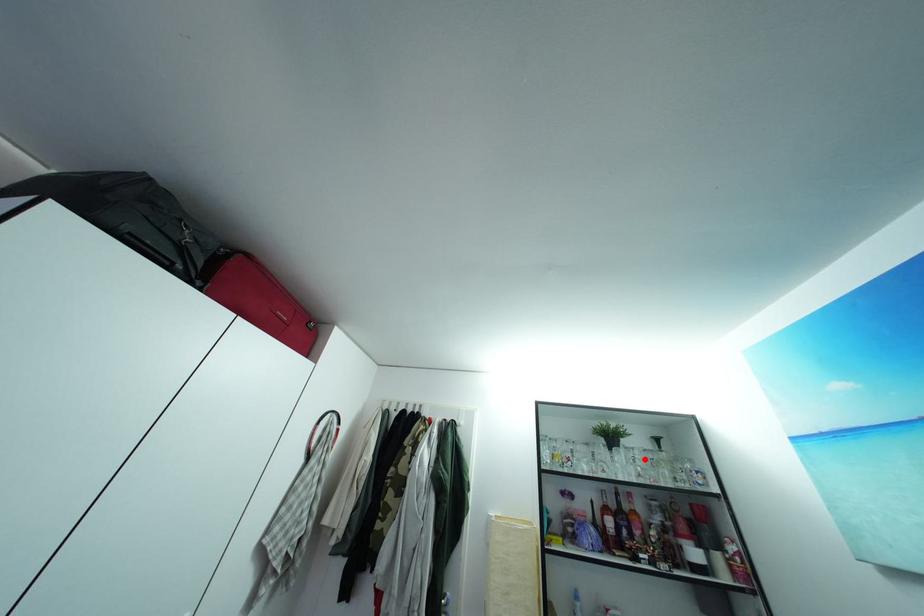
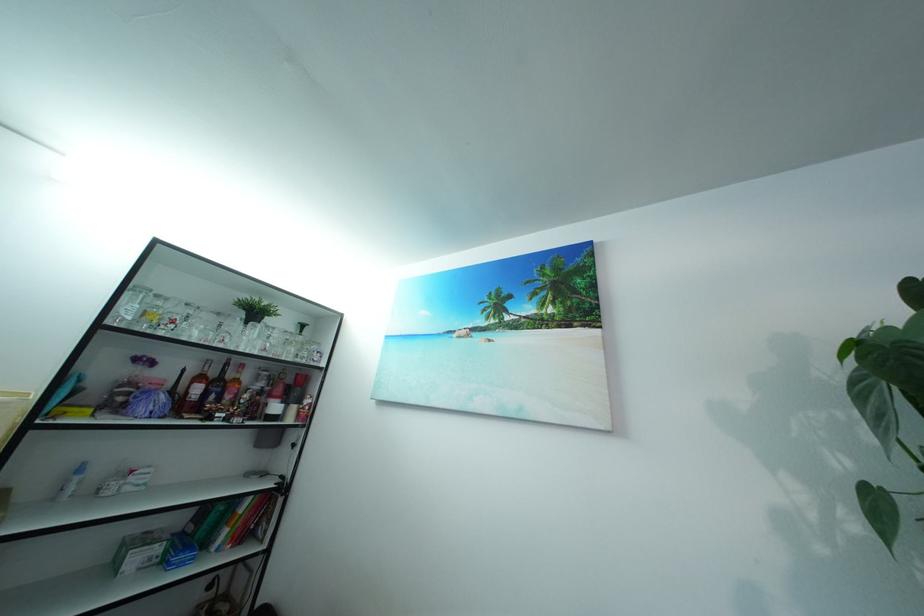
In the second image, find the point that corresponds to the highlighted location in the first image.

(284, 339)